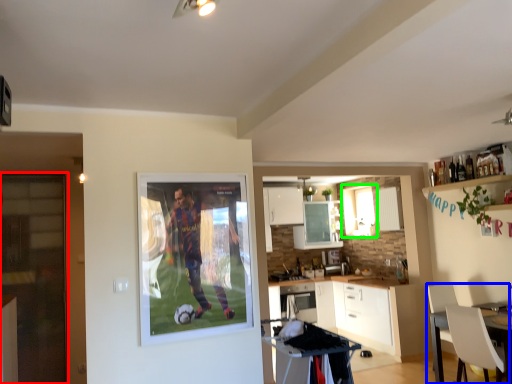
Question: Based on their relative distances, which object is farther from glass door (highlighted by a red box)? Choose from chair (highlighted by a blue box) and window (highlighted by a green box).

Choices:
 (A) chair
 (B) window

Answer: (A)